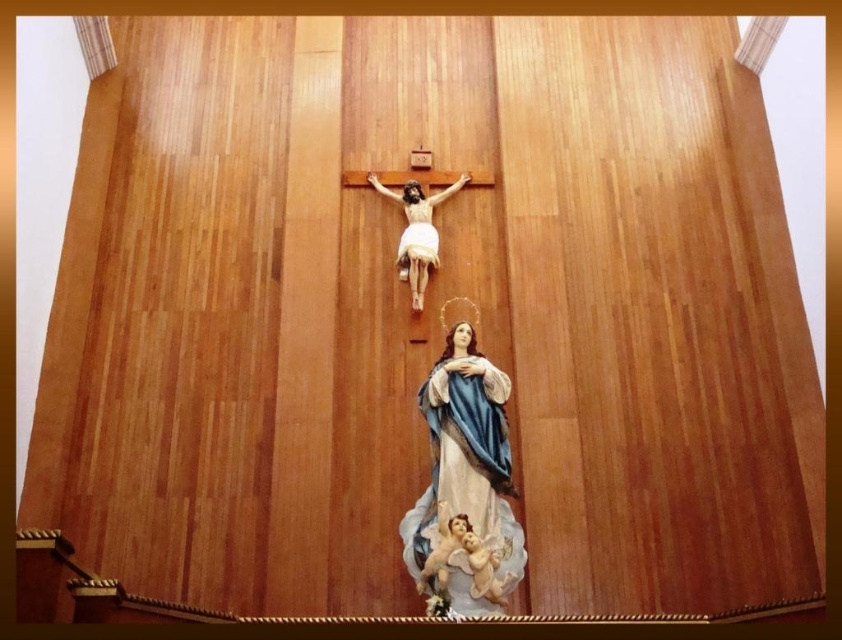
Question: Which point is farther from the camera taking this photo?

Choices:
 (A) (441, 513)
 (B) (494, 576)

Answer: (A)

Question: Which point is farther to the camera?

Choices:
 (A) polychrome painted statue at center
 (B) smooth beige cherub at lower center
 (C) matte white figure at center

Answer: (C)

Question: Can you confirm if polychrome painted statue at center is wider than smooth beige cherub at lower center?

Choices:
 (A) yes
 (B) no

Answer: (A)

Question: Does matte white figure at center have a larger size compared to smooth beige cherub at lower center?

Choices:
 (A) no
 (B) yes

Answer: (B)

Question: Estimate the real-world distances between objects in this image. Which object is closer to the matte white figure at center?

Choices:
 (A) smooth beige cherub at lower center
 (B) polychrome painted statue at center
 (C) porcelain cherub at lower center

Answer: (B)

Question: Does matte white figure at center have a smaller size compared to smooth beige cherub at lower center?

Choices:
 (A) no
 (B) yes

Answer: (A)